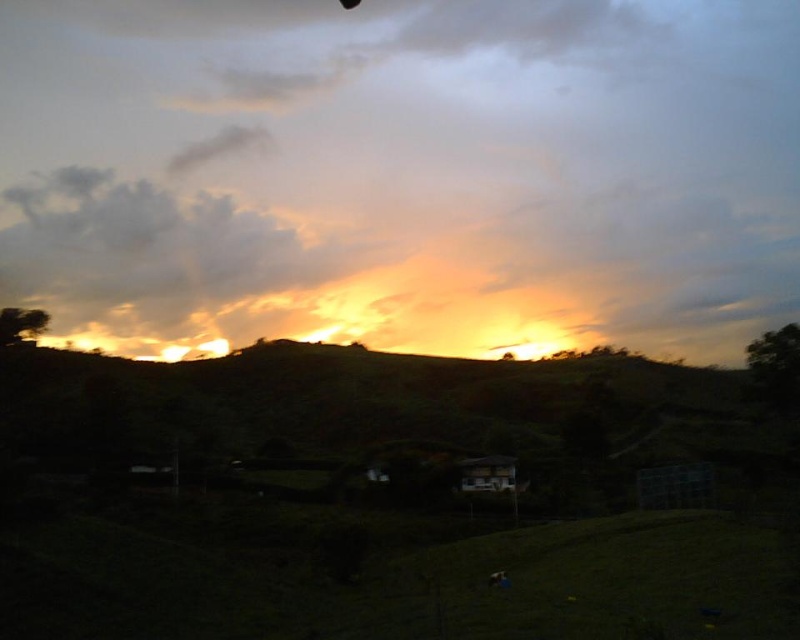
Question: Which point appears farthest from the camera in this image?

Choices:
 (A) (234, 93)
 (B) (54, 256)

Answer: (A)

Question: Is cloudy orange sky at upper center below cloudy sky at upper center?

Choices:
 (A) no
 (B) yes

Answer: (B)

Question: Which point is farther to the camera?

Choices:
 (A) cloudy sky at upper center
 (B) cloudy orange sky at upper center

Answer: (A)

Question: Is cloudy orange sky at upper center further to camera compared to cloudy sky at upper center?

Choices:
 (A) no
 (B) yes

Answer: (A)

Question: Is cloudy orange sky at upper center positioned in front of cloudy sky at upper center?

Choices:
 (A) no
 (B) yes

Answer: (B)